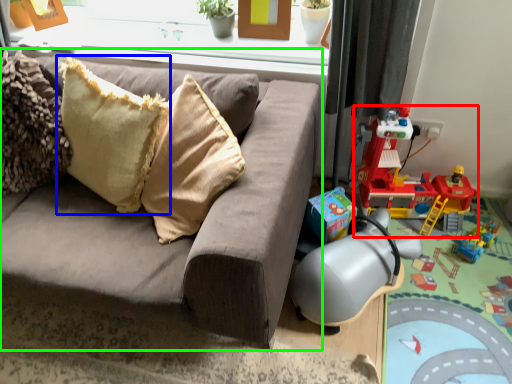
Question: Which object is the farthest from toy (highlighted by a red box)? Choose among these: pillow (highlighted by a blue box) or studio couch (highlighted by a green box).

Choices:
 (A) pillow
 (B) studio couch

Answer: (A)